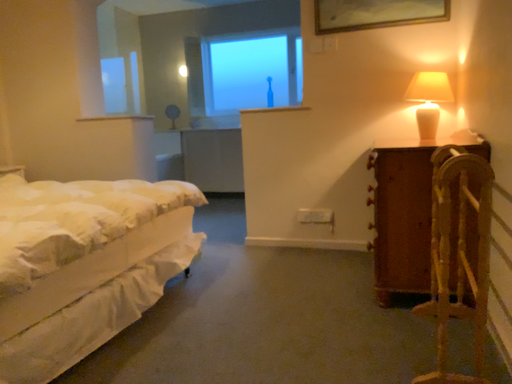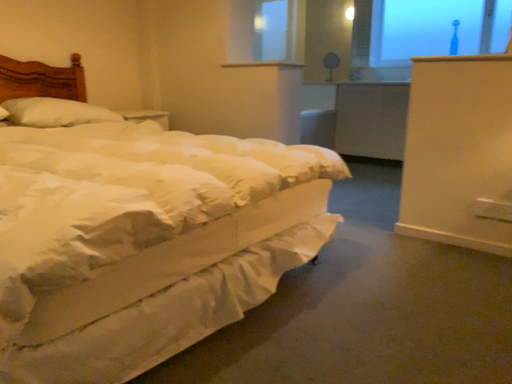
Question: Which way did the camera rotate in the video?

Choices:
 (A) rotated left
 (B) rotated right

Answer: (A)